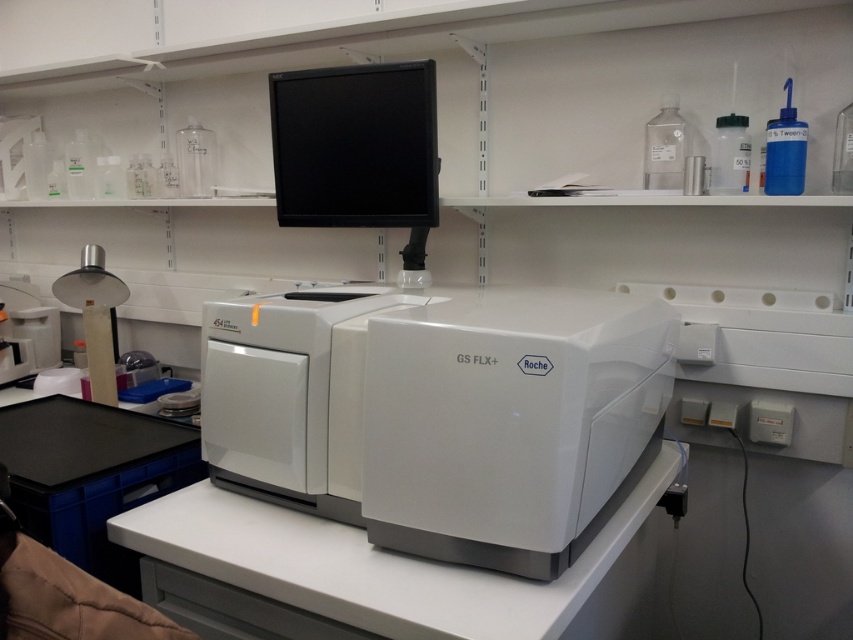
You are a technician in a lab who needs to place a 24 inch long cable between the white plastic printer at center and the black glossy monitor at upper center. Can you fit the cable between them without bending it too much?

The distance between the white plastic printer at center and the black glossy monitor at upper center is 22.67 inches. Since the cable is 24 inches long, it is longer than the required distance. You can fit the cable between them with some slack, avoiding excessive bending.

You are standing in front of the Roche GS FLX sequencing machine in the lab. There are two points marked in the image. The first point is at coordinate point (476, 387) and the second is at point (427, 176). Which point is closer to you?

Point (476, 387) is closer to the camera than point (427, 176).

You are a technician standing in front of the white plastic printer at center in the lab. You need to reach the black monitor mounted above the sequencing machine. Can you comfortably reach the monitor without moving the printer?

The white plastic printer at center is 36.45 inches away from you. Since the monitor is mounted above the sequencing machine, which is separate from the printer, you can comfortably reach the monitor without needing to move the printer.